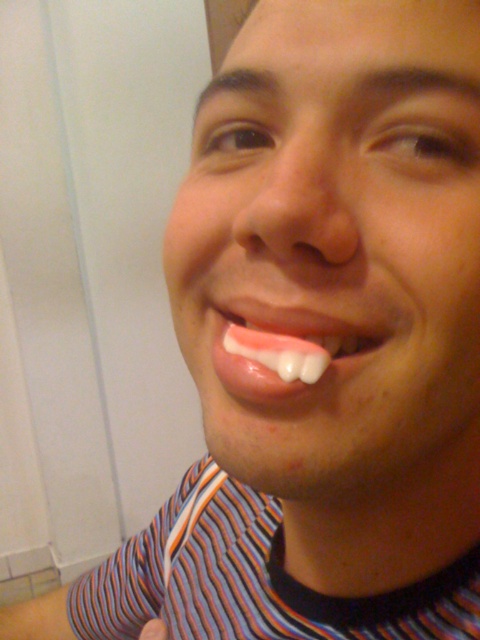
Measure the distance from striped fabric shirt at lower center to pink glossy tongue at center.

striped fabric shirt at lower center and pink glossy tongue at center are 26.99 centimeters apart.

Can you confirm if striped fabric shirt at lower center is positioned to the right of pink glossy tongue at center?

Incorrect, striped fabric shirt at lower center is not on the right side of pink glossy tongue at center.

Describe the element at coordinates (251, 579) in the screenshot. I see `striped fabric shirt at lower center` at that location.

Where is `striped fabric shirt at lower center`? Image resolution: width=480 pixels, height=640 pixels. striped fabric shirt at lower center is located at coordinates (251, 579).